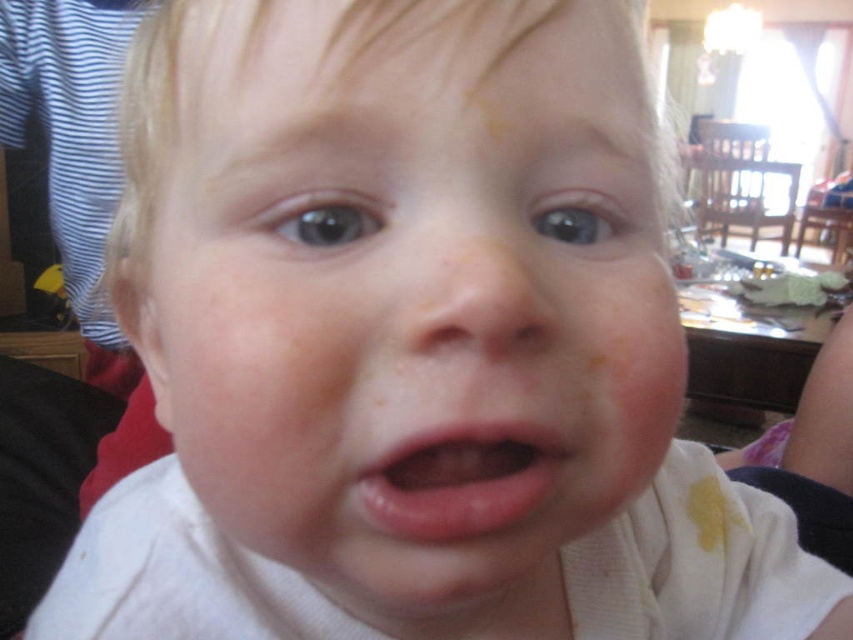
Is smooth skin face at center bigger than pink smooth lips at center?

Correct, smooth skin face at center is larger in size than pink smooth lips at center.

Is point (234, 472) farther from viewer compared to point (405, 442)?

Yes.

Where is `smooth skin face at center`? The image size is (853, 640). smooth skin face at center is located at coordinates (416, 296).